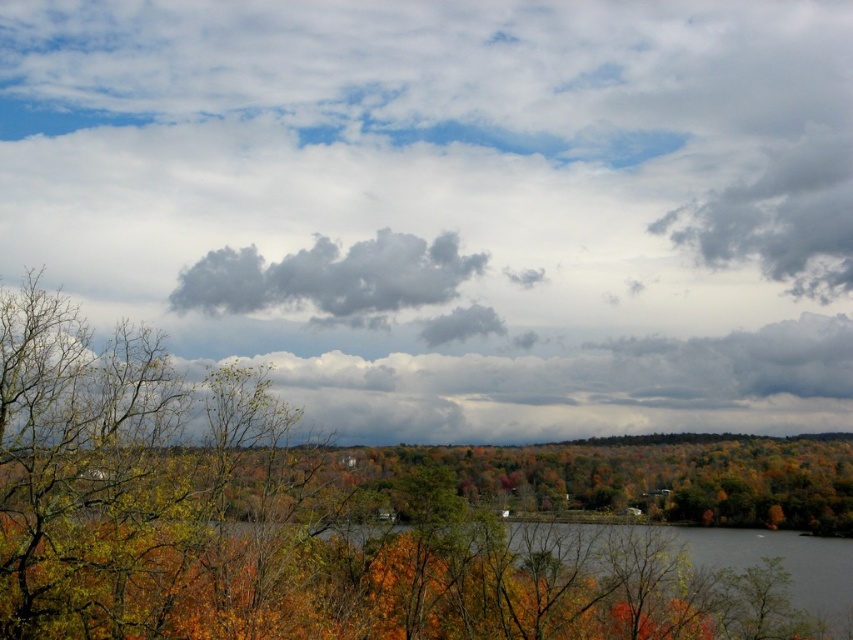
Question: Can you confirm if green matte tree at center is positioned below dark gray fluffy cloud at center?

Choices:
 (A) yes
 (B) no

Answer: (A)

Question: Which point is farther to the camera?

Choices:
 (A) green matte tree at center
 (B) dark gray fluffy cloud at center
 (C) cloudy sky at upper center

Answer: (B)

Question: Which is farther from the dark gray fluffy cloud at center?

Choices:
 (A) cloudy sky at upper center
 (B) green matte tree at center

Answer: (B)

Question: Does green matte tree at center appear over dark gray fluffy cloud at center?

Choices:
 (A) yes
 (B) no

Answer: (B)

Question: Does green matte tree at center appear on the left side of dark gray fluffy cloud at center?

Choices:
 (A) no
 (B) yes

Answer: (A)

Question: Which object appears farthest from the camera in this image?

Choices:
 (A) green matte tree at center
 (B) cloudy sky at upper center
 (C) dark gray fluffy cloud at center

Answer: (C)